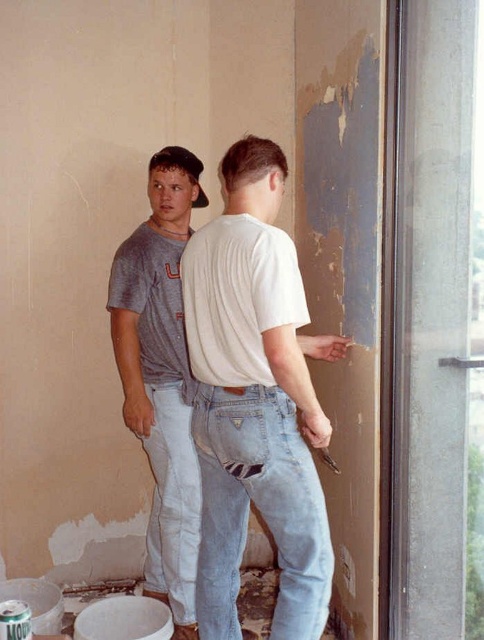
What is the color of the clothing item located at the coordinates point (256, 401)?

The clothing item at point (256, 401) is a white matte t shirt.